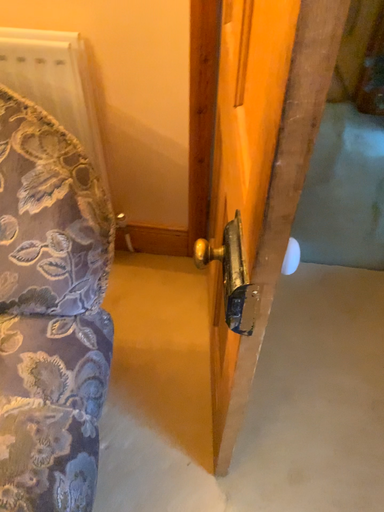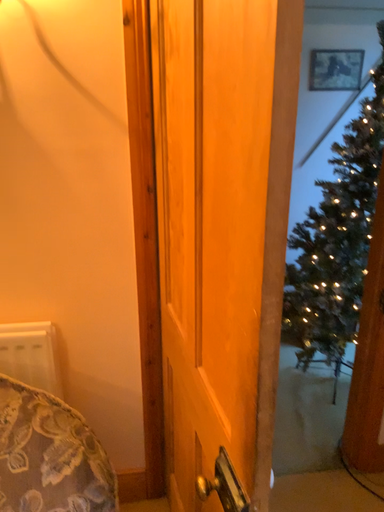
Question: Which way did the camera rotate in the video?

Choices:
 (A) rotated left
 (B) rotated right

Answer: (B)